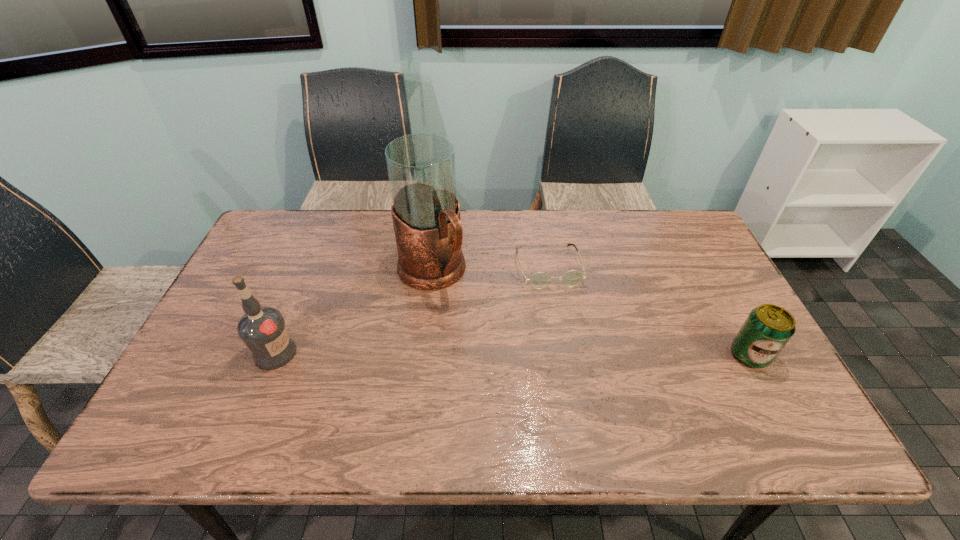
The height and width of the screenshot is (540, 960). Identify the location of free spot on the desktop that is between the third shortest object and the rightmost object and is positioned with the handle on the side of the pitcher. (502, 354).

Find the location of a particular element. vacant space on the desktop that is between the second tallest object and the beer can and is positioned on the lenses of the spectacles is located at coordinates (574, 354).